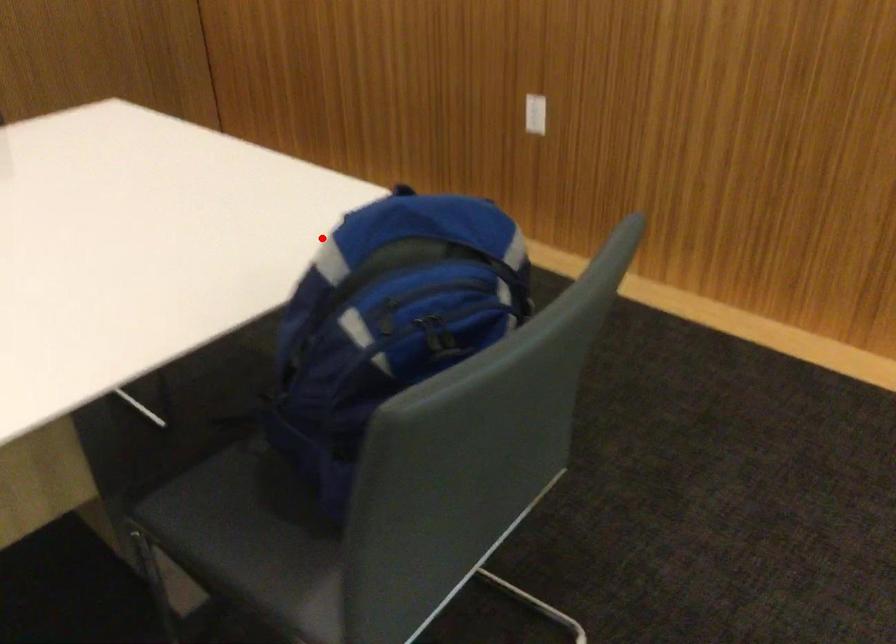
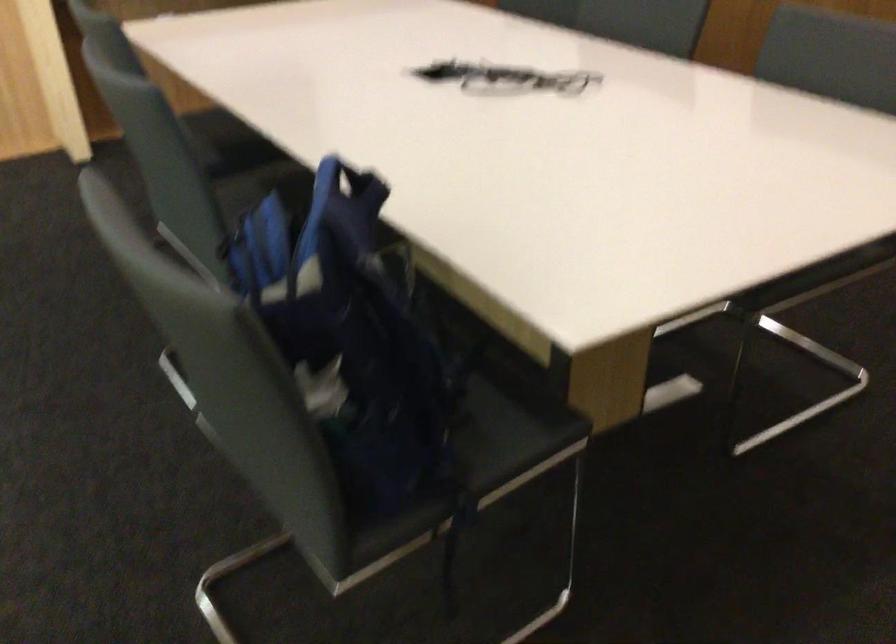
In the second image, find the point that corresponds to the highlighted location in the first image.

(349, 184)